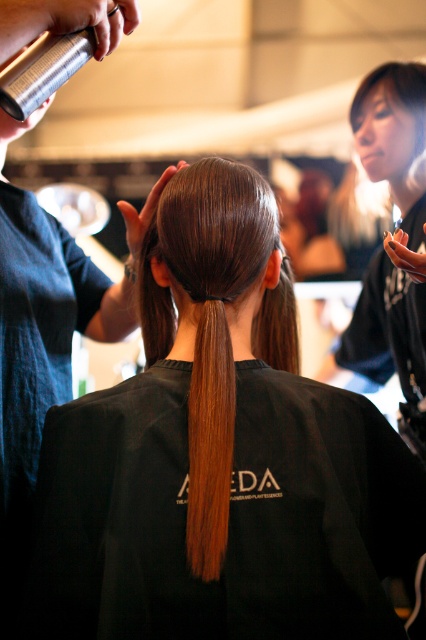
You are a photographer at the event and want to ensure the two points in the image are in focus. Which point, point (x=172, y=228) or point (x=408, y=136), is closer to your camera lens?

Point (x=172, y=228) is closer to the camera than point (x=408, y=136).

You are a photographer standing in the salon and want to capture a closeup shot of both the brown shiny hair at center and the smooth black hair at upper right without moving the subjects. Can you fit both into your camera frame if your camera has a maximum coverage of 30 inches?

The distance between the brown shiny hair at center and the smooth black hair at upper right is 32.26 inches, which exceeds the camera frame coverage of 30 inches. Therefore, you cannot capture both in a single shot without moving the subjects.

You are a stylist at the event and need to apply a product to both the shiny brown ponytail at center and the smooth black hair at upper right. Given that your reach is 2.5 feet, can you reach both areas without moving your position?

The shiny brown ponytail at center and smooth black hair at upper right are 30.96 inches apart. Since 30.96 inches is equal to 2.58 feet, which is slightly longer than your reach of 2.5 feet, you cannot reach both areas without moving your position.